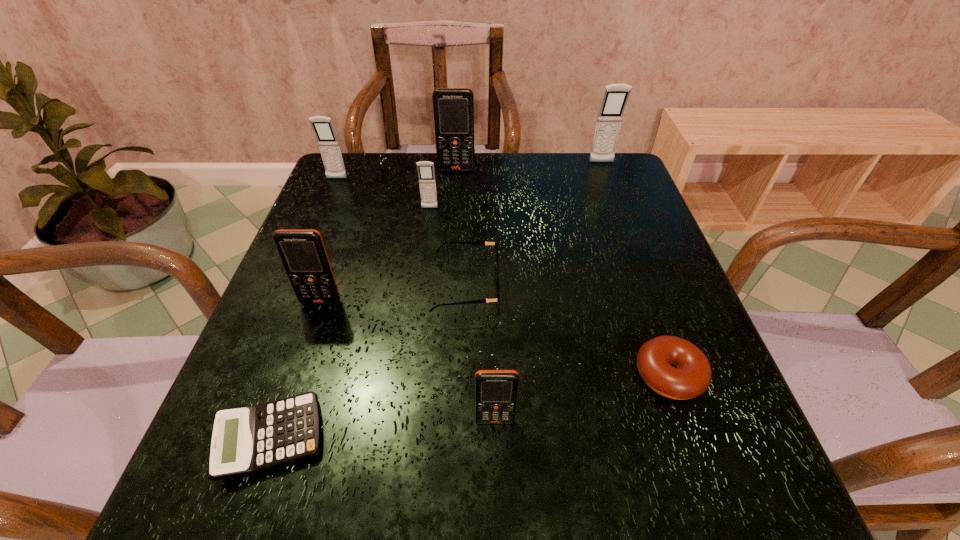
Where is `the rightmost gray cellular telephone`? The height and width of the screenshot is (540, 960). the rightmost gray cellular telephone is located at coordinates (615, 97).

Locate an element on the screen. the farthest gray cellular telephone is located at coordinates (615, 97).

Identify the location of the farthest orange cellular telephone. The width and height of the screenshot is (960, 540). click(x=453, y=108).

Identify the location of the eighth nearest object. (453, 108).

Find the location of a particular element. the second nearest gray cellular telephone is located at coordinates (329, 146).

The width and height of the screenshot is (960, 540). I want to click on the third farthest cellular telephone, so click(x=329, y=146).

The height and width of the screenshot is (540, 960). I want to click on the second biggest orange cellular telephone, so click(x=302, y=252).

The height and width of the screenshot is (540, 960). Find the location of `the leftmost orange cellular telephone`. the leftmost orange cellular telephone is located at coordinates (302, 252).

Find the location of a particular element. This screenshot has width=960, height=540. the nearest cellular telephone is located at coordinates (495, 390).

At what (x,y) coordinates should I click in order to perform the action: click on the second cellular telephone from right to left. Please return your answer as a coordinate pair (x, y). Looking at the image, I should click on (495, 390).